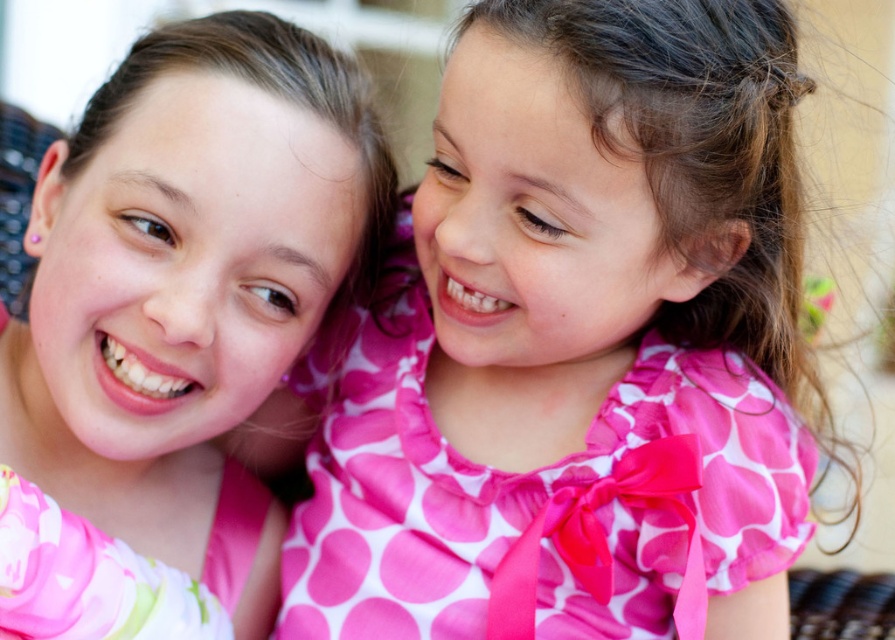
Question: Can you confirm if pink polka dot dress at center is positioned below pink fabric at upper left?

Choices:
 (A) no
 (B) yes

Answer: (B)

Question: Which of the following is the closest to the observer?

Choices:
 (A) pink fabric at upper left
 (B) pink polka dot dress at center

Answer: (A)

Question: Which object is farther from the camera taking this photo?

Choices:
 (A) pink polka dot dress at center
 (B) pink fabric at upper left

Answer: (A)

Question: Can you confirm if pink polka dot dress at center is wider than pink fabric at upper left?

Choices:
 (A) yes
 (B) no

Answer: (A)

Question: Is pink polka dot dress at center further to camera compared to pink fabric at upper left?

Choices:
 (A) yes
 (B) no

Answer: (A)